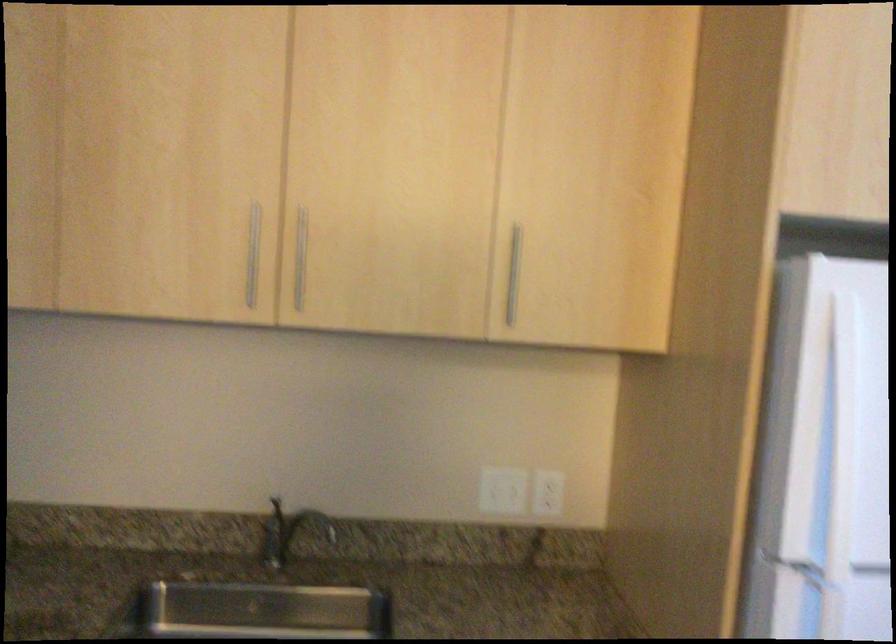
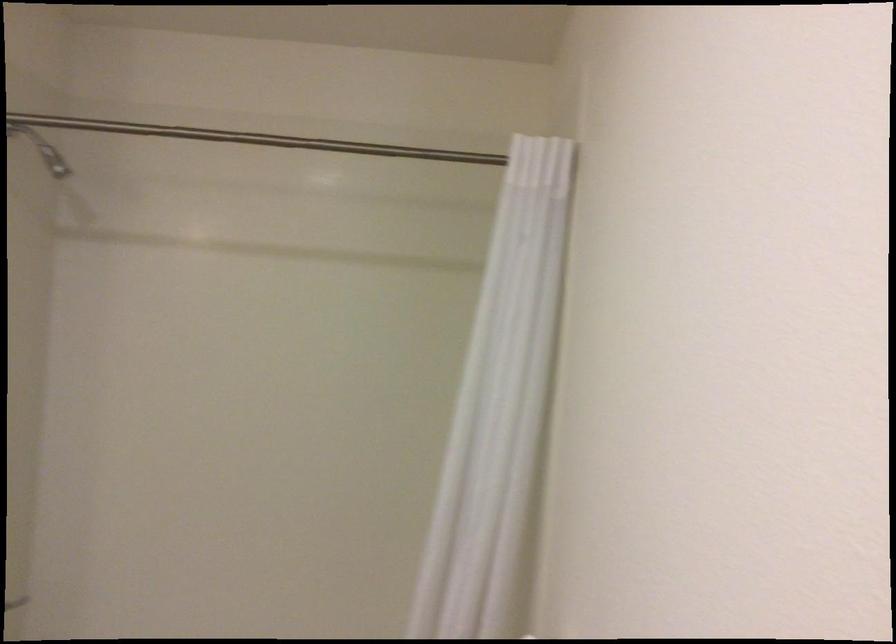
Question: The images are taken continuously from a first-person perspective. In which direction is your viewpoint rotating?

Choices:
 (A) Left
 (B) Right
 (C) Up
 (D) Down

Answer: (A)